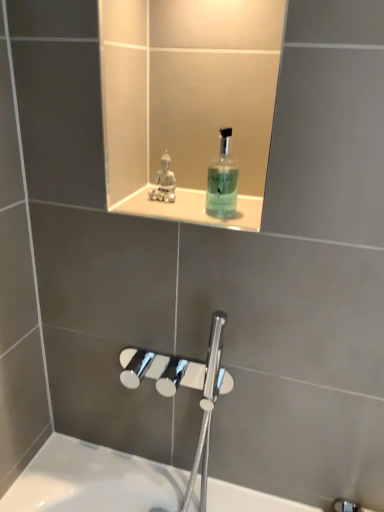
Question: Can you confirm if translucent glass mouthwash at upper center is taller than white glossy ledge at upper center?

Choices:
 (A) no
 (B) yes

Answer: (B)

Question: From the image's perspective, would you say translucent glass mouthwash at upper center is shown under white glossy ledge at upper center?

Choices:
 (A) no
 (B) yes

Answer: (A)

Question: Is translucent glass mouthwash at upper center beside white glossy ledge at upper center?

Choices:
 (A) yes
 (B) no

Answer: (A)

Question: Could you tell me if translucent glass mouthwash at upper center is facing white glossy ledge at upper center?

Choices:
 (A) no
 (B) yes

Answer: (A)

Question: Is there a large distance between translucent glass mouthwash at upper center and white glossy ledge at upper center?

Choices:
 (A) no
 (B) yes

Answer: (A)

Question: Would you say white glossy ledge at upper center is inside or outside satin silver statue at upper center?

Choices:
 (A) outside
 (B) inside

Answer: (A)

Question: Considering the positions of point (188, 192) and point (172, 201), is point (188, 192) closer or farther from the camera than point (172, 201)?

Choices:
 (A) farther
 (B) closer

Answer: (A)

Question: From a real-world perspective, relative to satin silver statue at upper center, is white glossy ledge at upper center vertically above or below?

Choices:
 (A) above
 (B) below

Answer: (B)

Question: Is white glossy ledge at upper center to the left or to the right of satin silver statue at upper center in the image?

Choices:
 (A) right
 (B) left

Answer: (A)

Question: In terms of size, does satin silver statue at upper center appear bigger or smaller than translucent glass mouthwash at upper center?

Choices:
 (A) small
 (B) big

Answer: (A)

Question: In terms of width, does satin silver statue at upper center look wider or thinner when compared to translucent glass mouthwash at upper center?

Choices:
 (A) wide
 (B) thin

Answer: (B)

Question: From a real-world perspective, relative to translucent glass mouthwash at upper center, is satin silver statue at upper center vertically above or below?

Choices:
 (A) below
 (B) above

Answer: (A)

Question: Does point (160, 196) appear closer or farther from the camera than point (213, 175)?

Choices:
 (A) closer
 (B) farther

Answer: (A)

Question: Based on their sizes in the image, would you say white glossy ledge at upper center is bigger or smaller than translucent glass mouthwash at upper center?

Choices:
 (A) small
 (B) big

Answer: (A)

Question: From a real-world perspective, is white glossy ledge at upper center positioned above or below translucent glass mouthwash at upper center?

Choices:
 (A) above
 (B) below

Answer: (B)